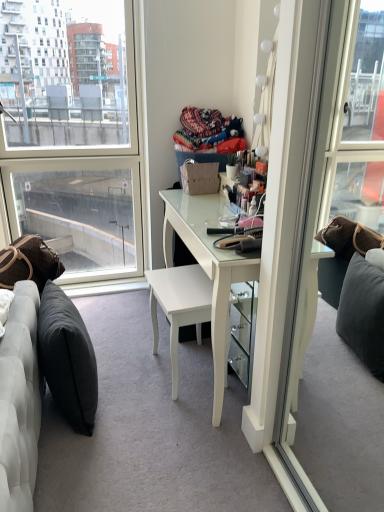
Identify the location of free point in front of white glossy chair at center. The width and height of the screenshot is (384, 512). (168, 416).